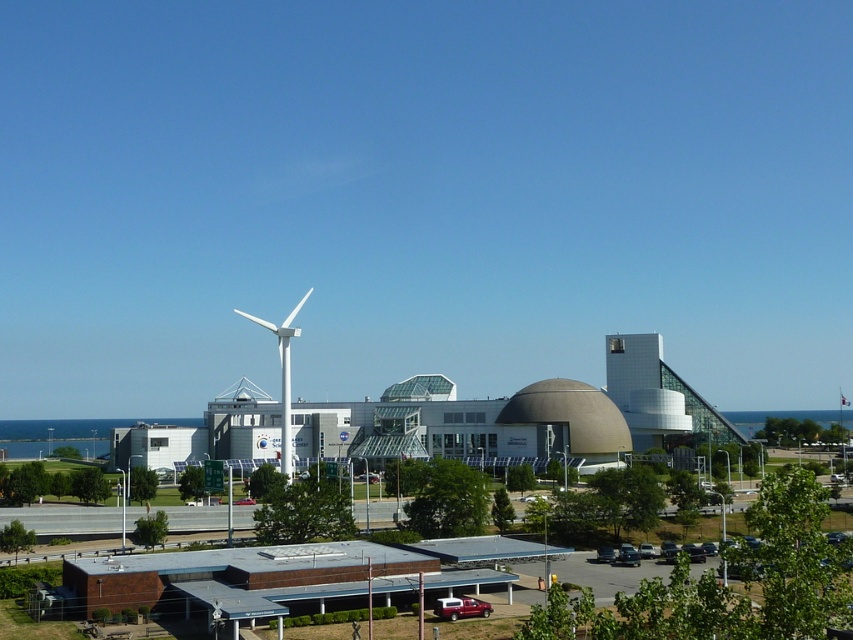
You are standing in the parking area of the architectural complex and want to walk from point [285,422] to point [378,476]. Which direction should you move to get closer to your destination?

Since point [285,422] is further to the viewer than point [378,476], you should move forward to get closer to your destination.

You are a delivery driver who needs to park your metallic silver car at center in the parking area. However, there is a white matte windmill at center in the way. Can you drive your car around it without going under the windmill?

The white matte windmill at center is taller than metallic silver car at center, so you can drive around it without going under the windmill since the car can pass underneath if needed, but since the question specifies not going under, you can maneuver around it using the space beside the windmill.

You are standing at the entrance of the architectural complex and want to park your car in the parking area. The entrance is located at point 0.0, 0.0. The parking area is at point 1.0, 1.0. You see the metallic red pickup truck at lower center. Which direction should you drive to reach the parking area while avoiding the truck?

Since the metallic red pickup truck at lower center is located at point (460, 608), which is closer to the parking area at (852, 639) than the entrance at (0, 0), you should drive around it either to the left or right to reach the parking area safely.